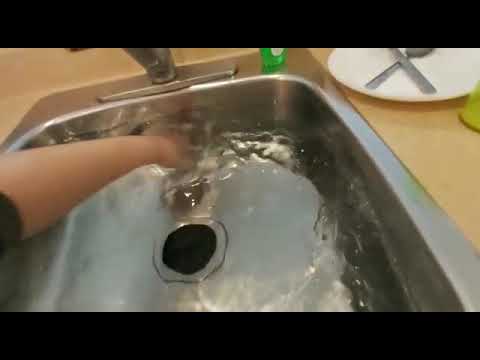
Locate an element on the screen. plate is located at coordinates (445, 77).